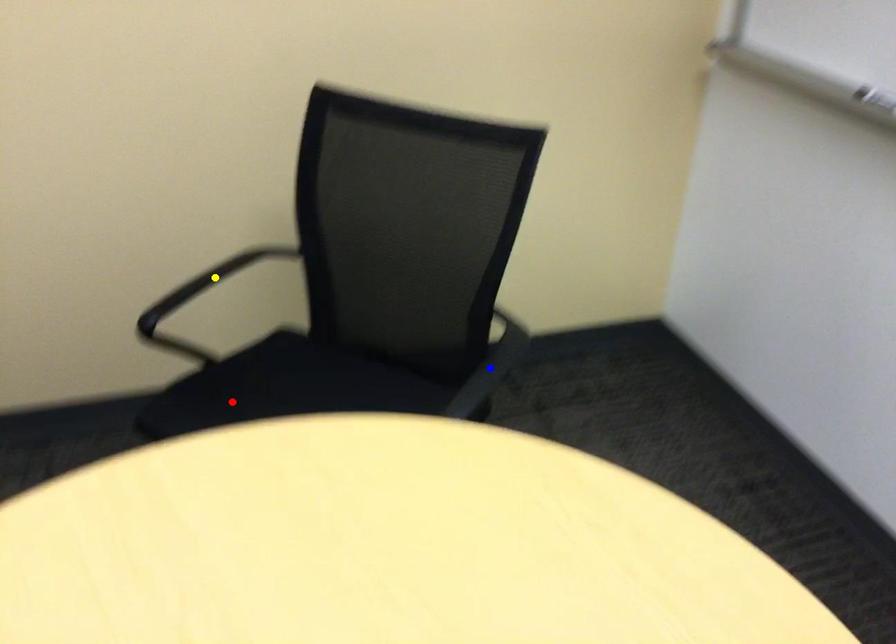
Order these from nearest to farthest:
- red point
- yellow point
- blue point

blue point
red point
yellow point